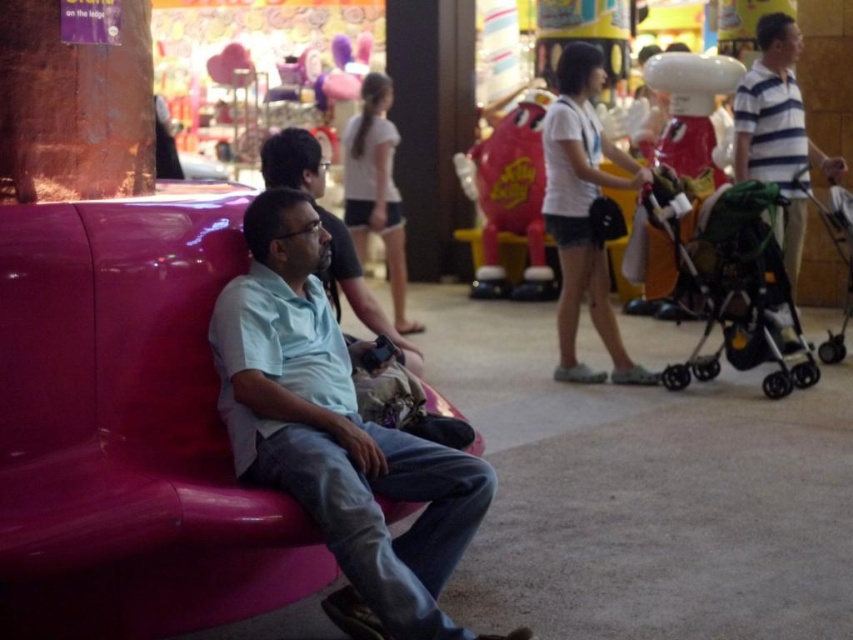
You are a security guard in the mall and need to ensure that two people are maintaining a safe distance of 2 meters apart. You observe the white matte shirt at center and the light blue shirt at center. Are they following the safety guidelines?

The white matte shirt at center is 2.48 meters away from the light blue shirt at center, so they are following the safety guidelines as they are slightly beyond the 2 meter requirement.

You are a security guard in the mall. You need to locate the white matte shirt at center and the green fabric stroller at right. Which one is positioned lower in the image?

The green fabric stroller at right is positioned lower than the white matte shirt at center.